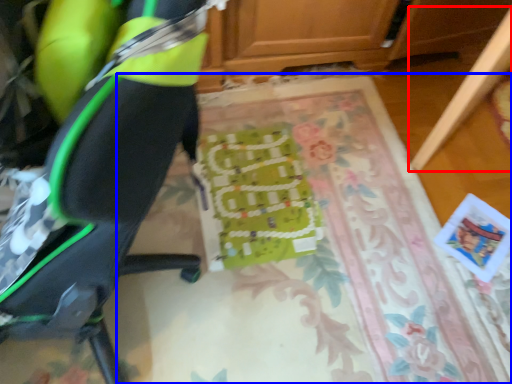
Question: Among these objects, which one is farthest to the camera, furniture (highlighted by a red box) or mat (highlighted by a blue box)?

Choices:
 (A) furniture
 (B) mat

Answer: (B)